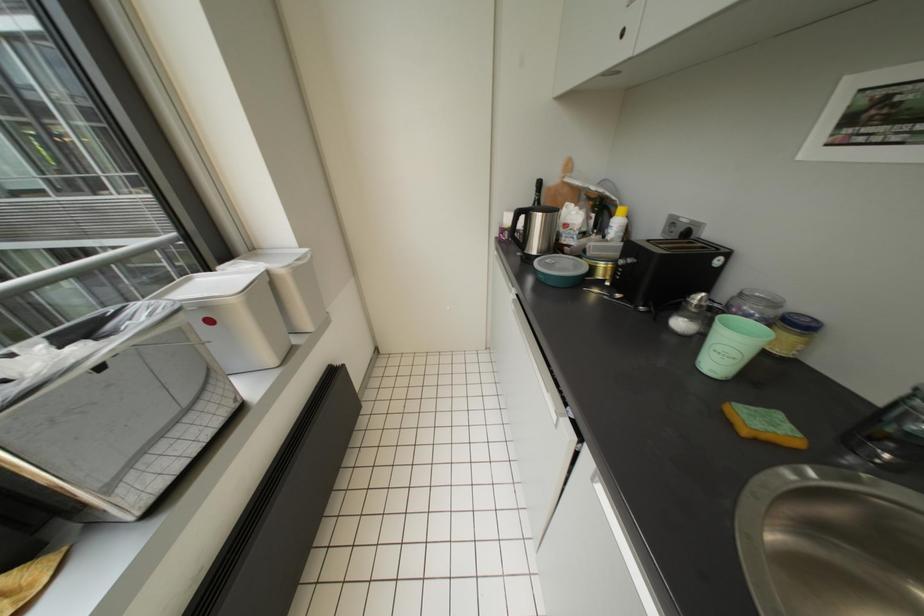
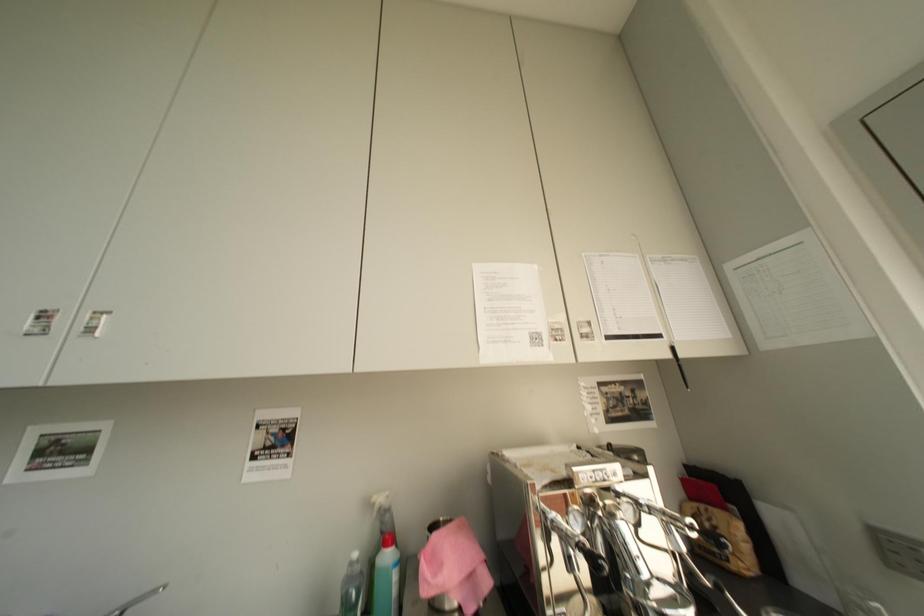
Question: The images are taken continuously from a first-person perspective. In which direction is your viewpoint rotating?

Choices:
 (A) Left
 (B) Right
 (C) Up
 (D) Down

Answer: (B)